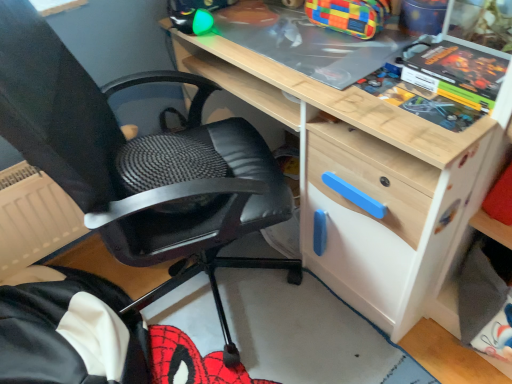
Question: Could you tell me if black leather chair at center is turned towards matt black comic book at upper right?

Choices:
 (A) yes
 (B) no

Answer: (A)

Question: Would you say black leather chair at center is outside matt black comic book at upper right?

Choices:
 (A) yes
 (B) no

Answer: (A)

Question: From the image's perspective, is black leather chair at center on matt black comic book at upper right?

Choices:
 (A) no
 (B) yes

Answer: (A)

Question: From the image's perspective, does black leather chair at center appear lower than matt black comic book at upper right?

Choices:
 (A) no
 (B) yes

Answer: (B)

Question: Considering the relative sizes of black leather chair at center and matt black comic book at upper right in the image provided, is black leather chair at center taller than matt black comic book at upper right?

Choices:
 (A) no
 (B) yes

Answer: (B)

Question: Is black leather chair at center wider than matt black comic book at upper right?

Choices:
 (A) yes
 (B) no

Answer: (A)

Question: Does matt black comic book at upper right have a lesser width compared to black leather chair at center?

Choices:
 (A) yes
 (B) no

Answer: (A)

Question: Can we say matt black comic book at upper right lies outside black leather chair at center?

Choices:
 (A) no
 (B) yes

Answer: (B)

Question: Does matt black comic book at upper right appear on the right side of black leather chair at center?

Choices:
 (A) yes
 (B) no

Answer: (A)

Question: Is the position of matt black comic book at upper right more distant than that of black leather chair at center?

Choices:
 (A) no
 (B) yes

Answer: (B)

Question: Does matt black comic book at upper right have a larger size compared to black leather chair at center?

Choices:
 (A) no
 (B) yes

Answer: (A)

Question: Would you say black leather chair at center is part of matt black comic book at upper right's contents?

Choices:
 (A) no
 (B) yes

Answer: (A)

Question: Is black leather chair at center wider or thinner than matt black comic book at upper right?

Choices:
 (A) wide
 (B) thin

Answer: (A)